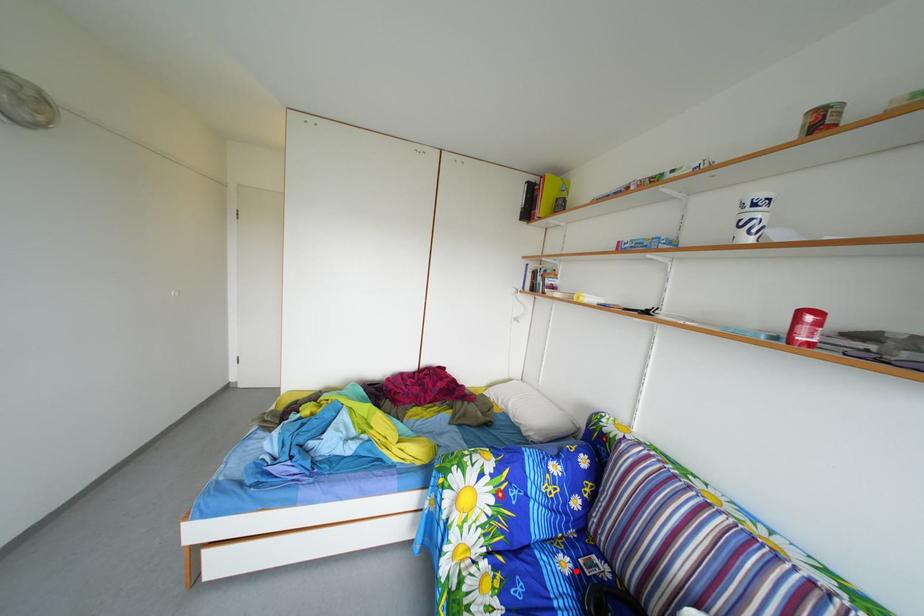
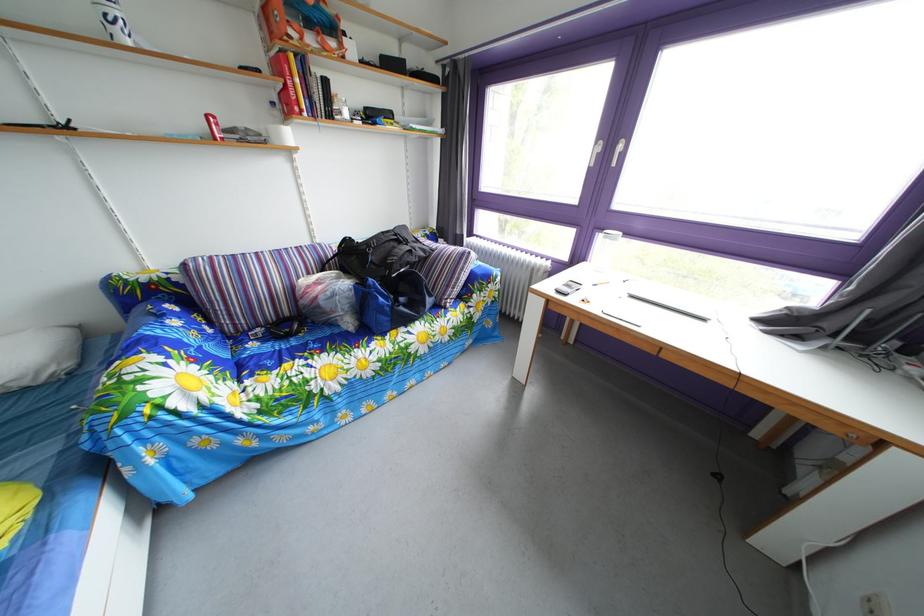
Question: I am providing you with two images of the same scene from different viewpoints. A red point is marked on the first image. At the location where the point appears in image 1, is it still visible in image 2?

Choices:
 (A) Yes
 (B) No

Answer: (A)